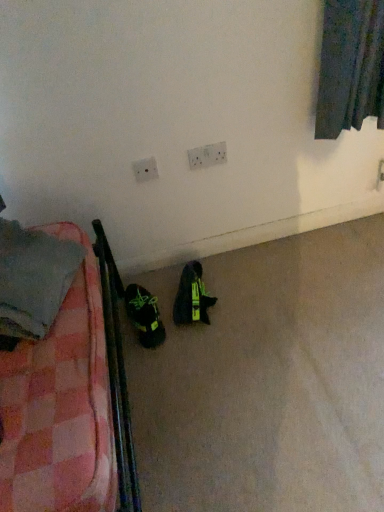
I want to click on vacant area that is situated to the right of green matte sneakers at lower left, arranged as the 2th footwear when viewed from the right, so click(x=180, y=328).